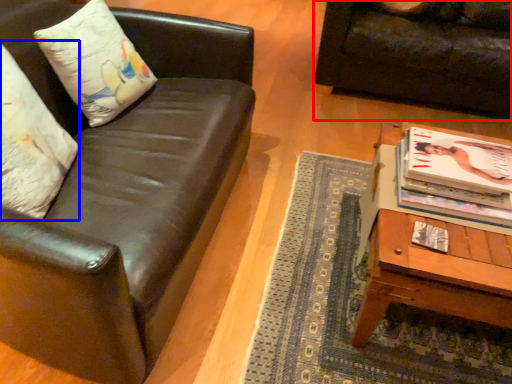
Question: Which object appears closest to the camera in this image, studio couch (highlighted by a red box) or pillow (highlighted by a blue box)?

Choices:
 (A) studio couch
 (B) pillow

Answer: (B)